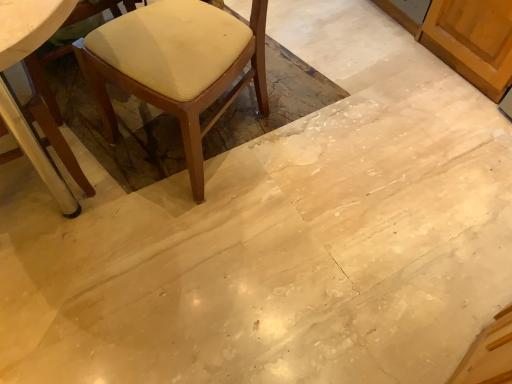
Locate an element on the screen. The height and width of the screenshot is (384, 512). free space to the left of matte beige cushioned chair at left, arranged as the first chair when viewed from the right is located at coordinates (102, 129).